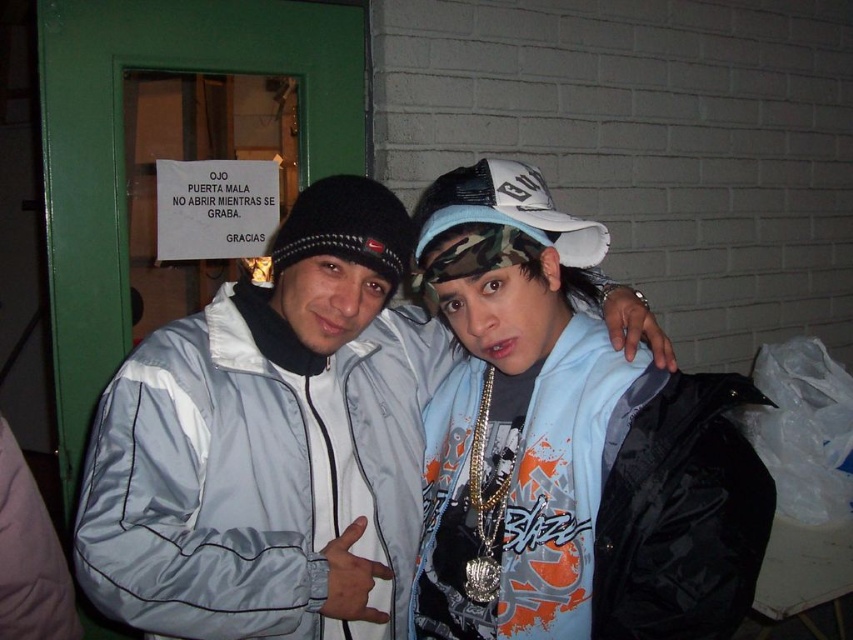
Question: Does light gray jacket at center appear on the right side of light blue fabric shirt at center?

Choices:
 (A) yes
 (B) no

Answer: (B)

Question: Which of the following is the closest to the observer?

Choices:
 (A) camo fabric baseball cap at upper center
 (B) light gray jacket at center

Answer: (B)

Question: Is light gray jacket at center above camo fabric baseball cap at upper center?

Choices:
 (A) no
 (B) yes

Answer: (A)

Question: Is light gray jacket at center above camo fabric baseball cap at upper center?

Choices:
 (A) no
 (B) yes

Answer: (A)

Question: Which point is farther to the camera?

Choices:
 (A) (527, 637)
 (B) (376, 364)
 (C) (538, 212)

Answer: (B)

Question: Which object is closer to the camera taking this photo?

Choices:
 (A) light blue fabric shirt at center
 (B) light gray jacket at center

Answer: (A)